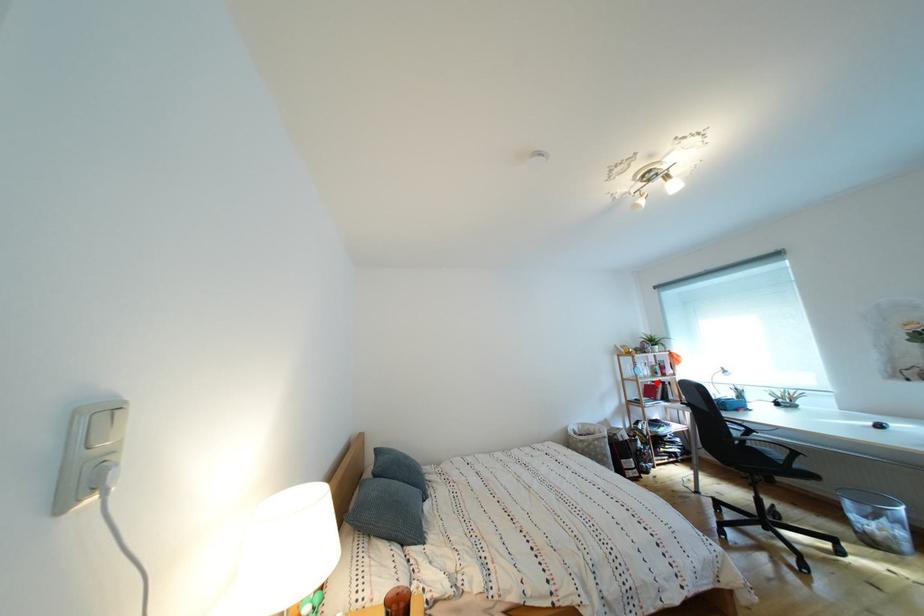
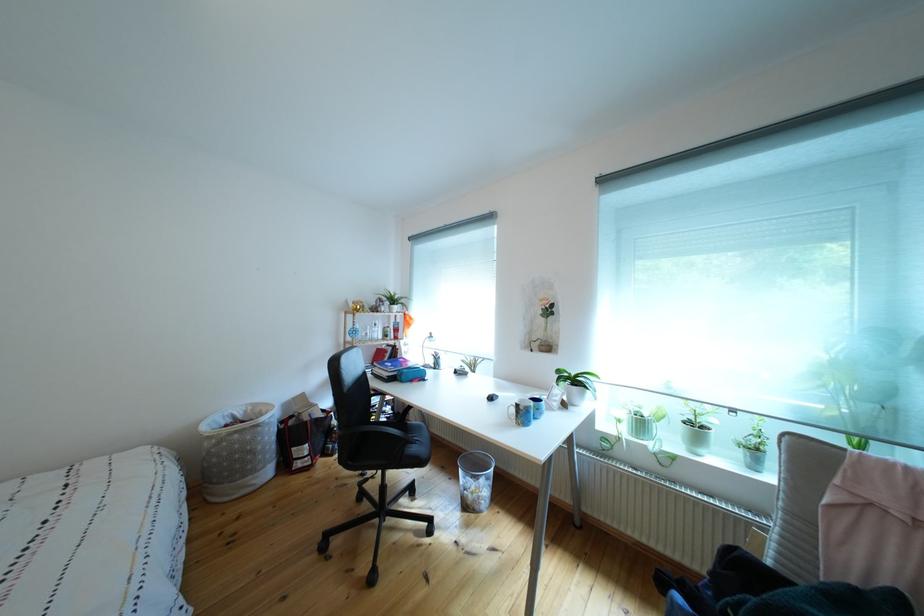
The point at the highlighted location is marked in the first image. Where is the corresponding point in the second image?

(383, 345)